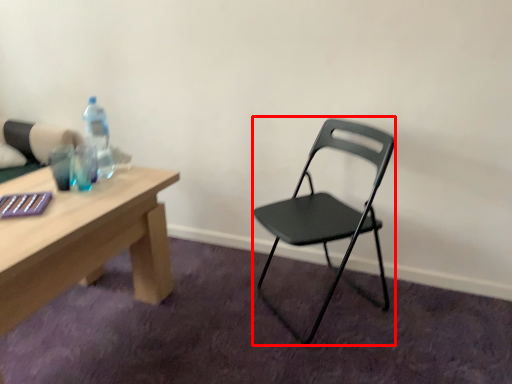
Question: From the image's perspective, what is the correct spatial positioning of chair (annotated by the red box) in reference to bottle?

Choices:
 (A) above
 (B) below

Answer: (B)